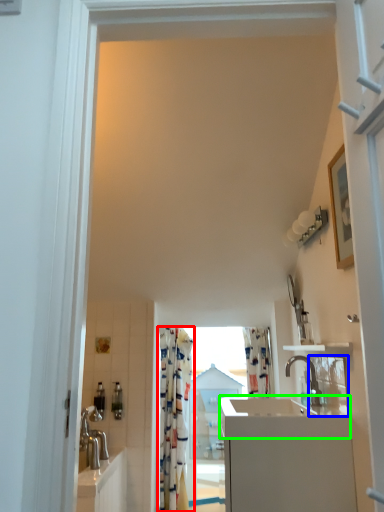
Question: Based on their relative distances, which object is farther from curtain (highlighted by a red box)? Choose from mirror (highlighted by a blue box) and counter top (highlighted by a green box).

Choices:
 (A) mirror
 (B) counter top

Answer: (B)